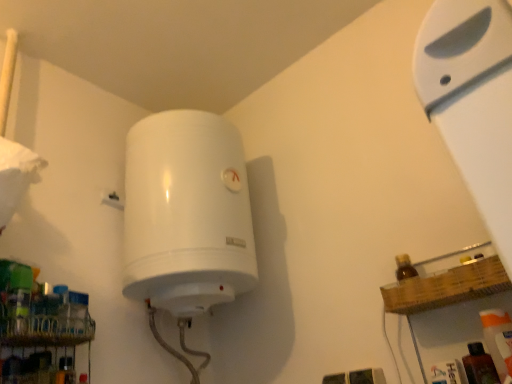
Question: Is translucent plastic spray bottle at lower right wider or thinner than white plastic shelf at upper right?

Choices:
 (A) wide
 (B) thin

Answer: (A)

Question: From a real-world perspective, is translucent plastic spray bottle at lower right positioned above or below white plastic shelf at upper right?

Choices:
 (A) below
 (B) above

Answer: (A)

Question: Considering the real-world distances, which object is farthest from the metallic wire rack at lower left?

Choices:
 (A) white plastic shelf at upper right
 (B) translucent plastic spray bottle at lower right

Answer: (A)

Question: Which object is the farthest from the translucent plastic spray bottle at lower right?

Choices:
 (A) metallic wire rack at lower left
 (B) white plastic shelf at upper right

Answer: (A)